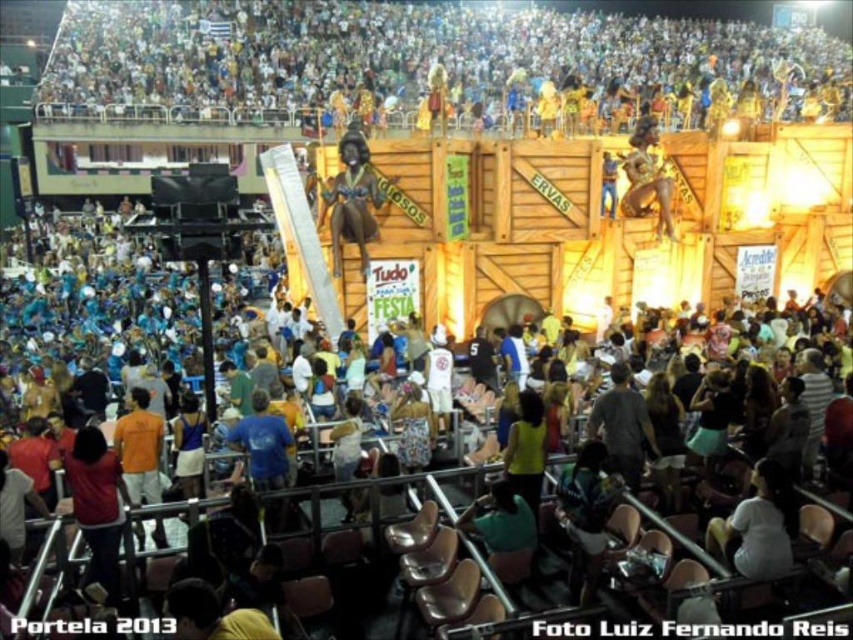
Question: Among these objects, which one is farthest from the camera?

Choices:
 (A) shiny gold statue at center
 (B) white plastic chairs at upper center
 (C) green matte shirt at lower center
 (D) white matte shirt at lower right

Answer: (B)

Question: Among these points, which one is farthest from the camera?

Choices:
 (A) (500, 509)
 (B) (347, 205)

Answer: (B)

Question: Which object is the farthest from the shiny gold statue at center?

Choices:
 (A) green matte shirt at lower center
 (B) white plastic chairs at upper center
 (C) white matte shirt at lower right

Answer: (B)

Question: Does white matte shirt at lower right appear on the left side of shiny gold statue at center?

Choices:
 (A) yes
 (B) no

Answer: (B)

Question: Is shiny gold statue at center to the right of green matte shirt at lower center from the viewer's perspective?

Choices:
 (A) yes
 (B) no

Answer: (B)

Question: Can you confirm if shiny gold statue at center is positioned to the right of green matte shirt at lower center?

Choices:
 (A) no
 (B) yes

Answer: (A)